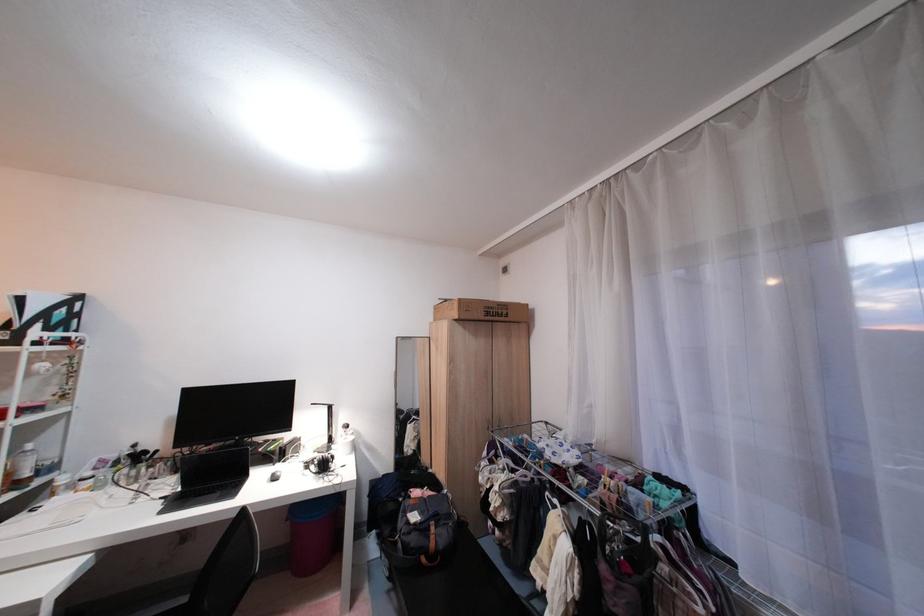
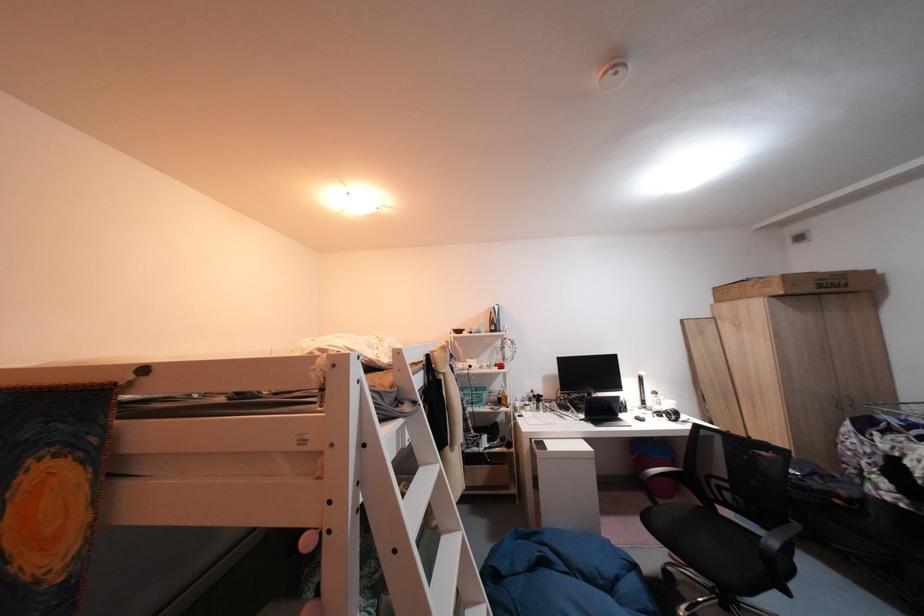
Question: I am providing you with two images of the same scene from different viewpoints. After the viewpoint changes to image2, which objects are now occluded?

Choices:
 (A) light blue basket
 (B) red trolley handle
 (C) chair sitting surface
 (D) black headphones

Answer: (D)